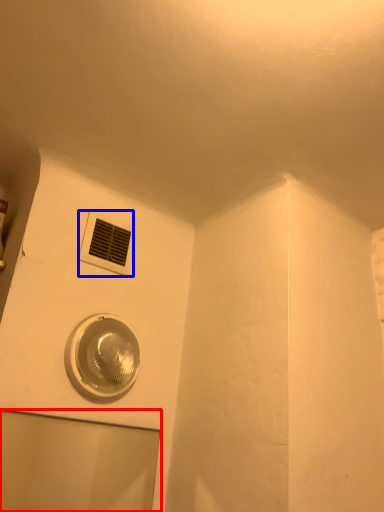
Question: Which object appears closest to the camera in this image, glass door (highlighted by a red box) or air conditioning (highlighted by a blue box)?

Choices:
 (A) glass door
 (B) air conditioning

Answer: (A)